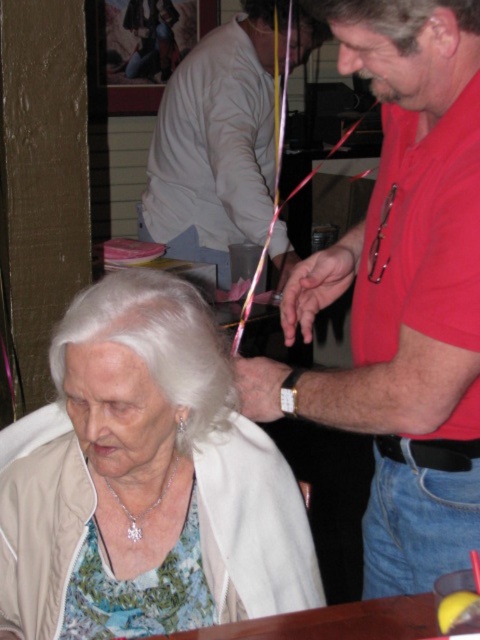
You are standing at the point labeled point (63, 337) and want to move to the point labeled point (223, 618). Is the path between them clear?

The path between point (63, 337) and point (223, 618) is clear because point (223, 618) is behind point (63, 337), so there is no obstruction in between.

Based on the scene description, where exactly is the red shirt at right located in terms of coordinates?

The red shirt at right is located at point coordinates of (403, 292).

You are a photographer taking a picture of the scene. You notice the white fabric at lower left and the white silky hair at center. Which object is closer to the camera?

The white fabric at lower left is closer to the camera because it is in front of the white silky hair at center.